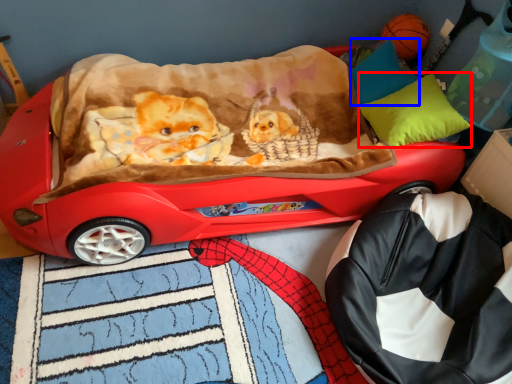
Question: Which of the following is the closest to the observer, pillow (highlighted by a red box) or pillow (highlighted by a blue box)?

Choices:
 (A) pillow
 (B) pillow

Answer: (A)